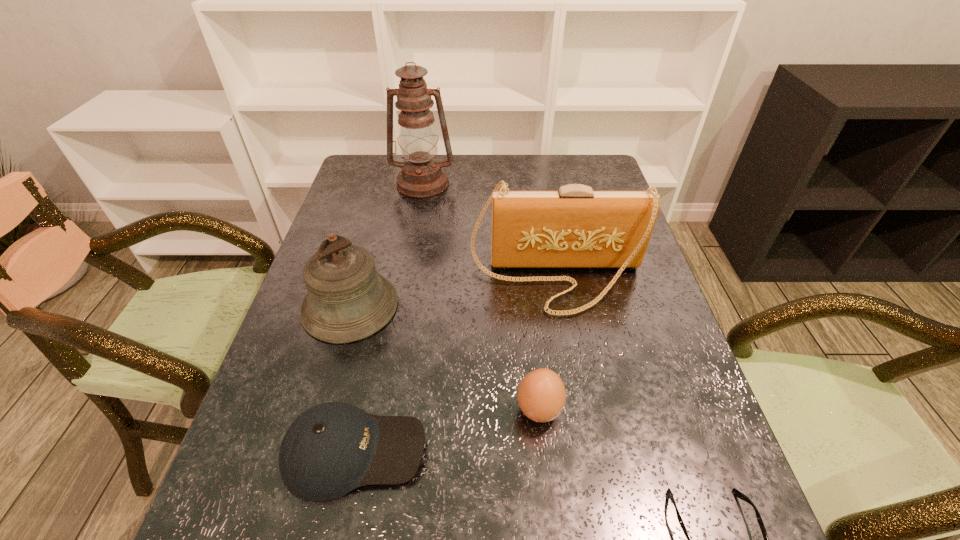
The height and width of the screenshot is (540, 960). I want to click on vacant space at the right edge, so click(x=631, y=389).

At what (x,y) coordinates should I click in order to perform the action: click on blank space at the far left corner. Please return your answer as a coordinate pair (x, y). The width and height of the screenshot is (960, 540). Looking at the image, I should click on (376, 161).

In the image, there is a desktop. Where is `free space at the far right corner`? This screenshot has height=540, width=960. free space at the far right corner is located at coordinates (576, 166).

Locate an element on the screen. The image size is (960, 540). vacant region between the fifth tallest object and the bell is located at coordinates (352, 379).

This screenshot has height=540, width=960. I want to click on empty space between the handbag and the tallest object, so click(490, 231).

Where is `free space that is in between the fourth tallest object and the handbag`? This screenshot has height=540, width=960. free space that is in between the fourth tallest object and the handbag is located at coordinates (547, 345).

In order to click on free spot between the bell and the baseball cap in this screenshot , I will do `click(352, 379)`.

I want to click on object identified as the second closest to the bell, so click(575, 227).

Select which object is the second closest to the third shortest object. Please provide its 2D coordinates. Your answer should be formatted as a tuple, i.e. [(x, y)], where the tuple contains the x and y coordinates of a point satisfying the conditions above.

[(740, 495)]